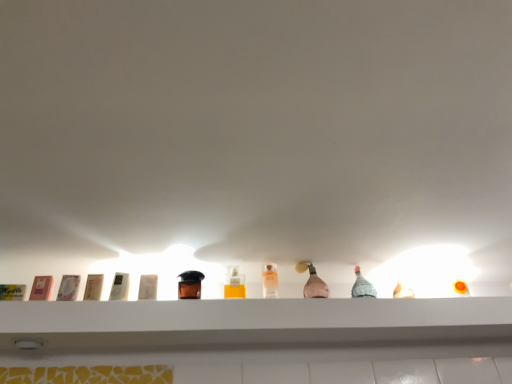
Question: Would you say translucent glass bottle at center, the second bottle positioned from the left, is to the left or to the right of brown leather toiletry at center, arranged as the fifth toiletry when viewed from the left, in the picture?

Choices:
 (A) left
 (B) right

Answer: (B)

Question: Is translucent glass bottle at center, the second bottle positioned from the left, wider or thinner than brown leather toiletry at center, arranged as the 1th toiletry when viewed from the right?

Choices:
 (A) thin
 (B) wide

Answer: (A)

Question: Based on their relative distances, which object is farther from the brown leather toiletry at center, arranged as the fifth toiletry when viewed from the left?

Choices:
 (A) white plastic container at center, positioned as the third toiletry in left-to-right order
 (B) translucent glass bottle at center, which appears as the 1th bottle when viewed from the right
 (C) white plastic container at center, which is the second toiletry in right-to-left order
 (D) pink glass bottle at center
 (E) matte pink soap at left, which ranks as the first toiletry in left-to-right order

Answer: (D)

Question: Based on their relative distances, which object is nearer to the translucent glass bottle at center, the second bottle positioned from the left?

Choices:
 (A) white plastic container at center, the fourth toiletry from the left
 (B) white plastic container at center, which is the 3th toiletry in right-to-left order
 (C) white glossy shelf at center
 (D) matte brown lotion at left, placed as the 2th toiletry when sorted from left to right
 (E) clear glass bottle at center, positioned as the second bottle in right-to-left order

Answer: (E)